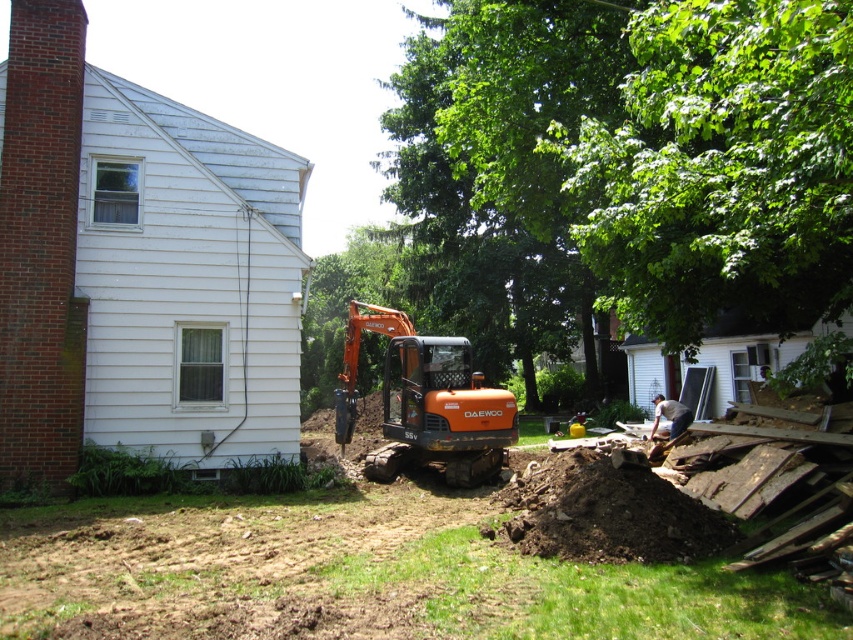
Between orange metallic excavator at center and dark brown wood at lower right, which one has less height?

With less height is orange metallic excavator at center.

Who is more distant from viewer, (631, 612) or (656, 404)?

The point (656, 404) is more distant.

Locate an element on the screen. orange metallic excavator at center is located at coordinates (355, 573).

Who is higher up, orange matte excavator at center or brown/dry soil at lower right?

orange matte excavator at center is higher up.

Who is more distant from viewer, (378, 468) or (547, 540)?

Point (378, 468)

The width and height of the screenshot is (853, 640). I want to click on orange matte excavator at center, so click(x=426, y=403).

Does point (357, 493) come in front of point (728, 541)?

No, it is not.

The height and width of the screenshot is (640, 853). I want to click on orange metallic excavator at center, so click(355, 573).